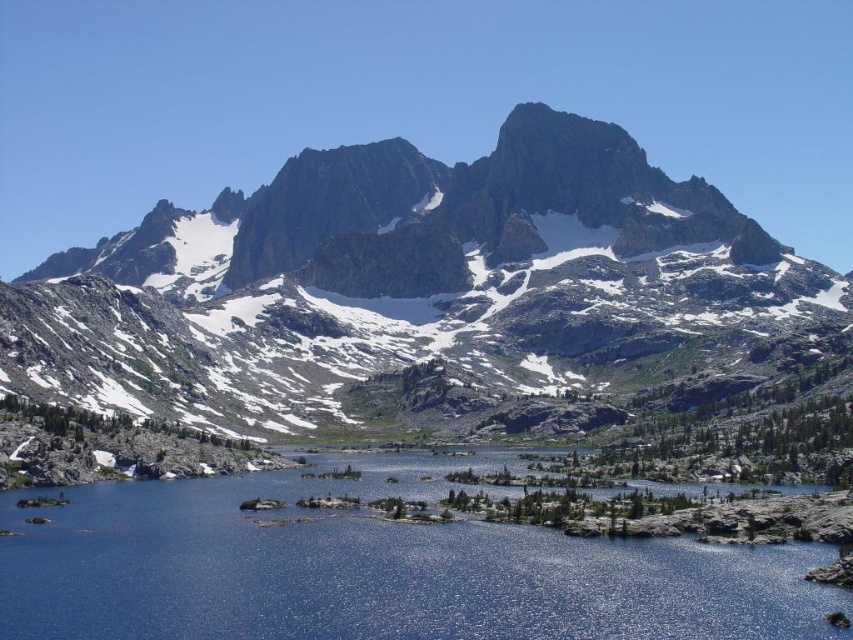
Who is more distant from viewer, [730,339] or [399,596]?

The point [730,339] is behind.

Which of these two, rocky gray mountain range at upper center or blue reflective water at center, stands shorter?

Standing shorter between the two is blue reflective water at center.

Is point (252, 244) farther from viewer compared to point (56, 572)?

Yes.

Locate an element on the screen. The width and height of the screenshot is (853, 640). rocky gray mountain range at upper center is located at coordinates (407, 280).